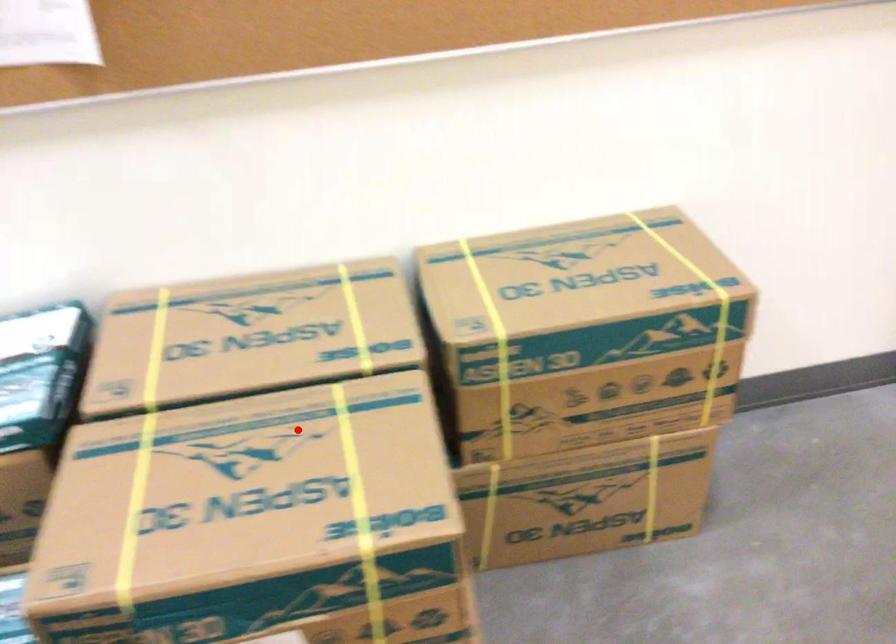
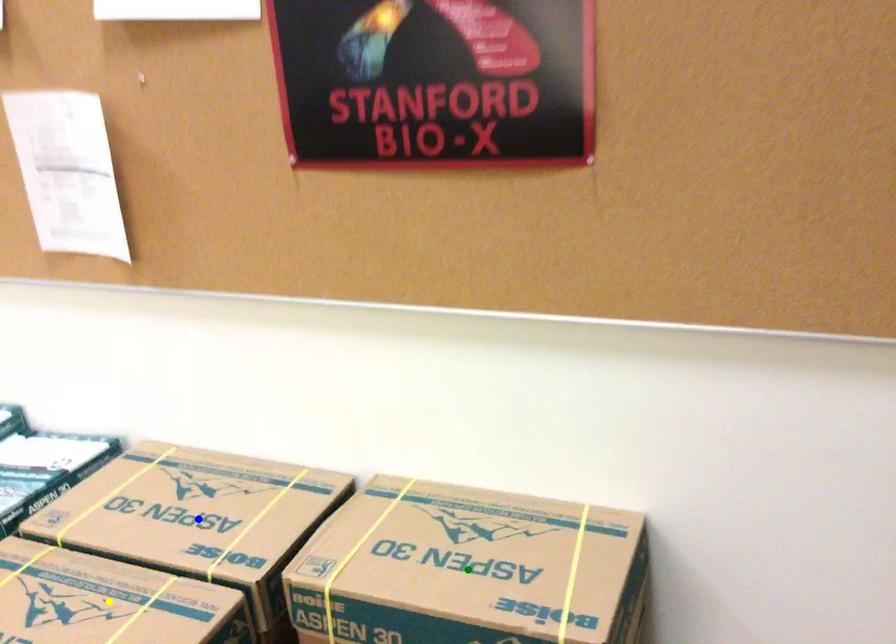
Question: I am providing you with two images of the same scene from different viewpoints. A red point is marked on the first image. You are given multiple points on the second image. Which mark in image 2 goes with the point in image 1?

Choices:
 (A) yellow point
 (B) blue point
 (C) green point

Answer: (A)